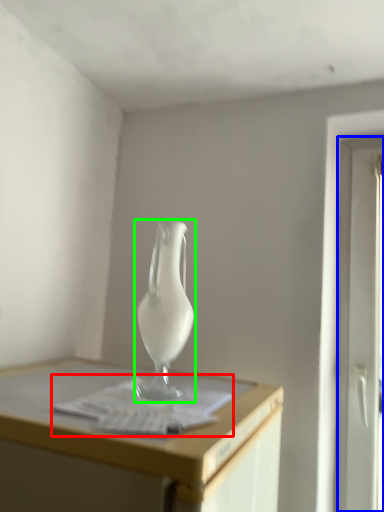
Question: Which object is positioned farthest from paper (highlighted by a red box)? Select from screen door (highlighted by a blue box) and vase (highlighted by a green box).

Choices:
 (A) screen door
 (B) vase

Answer: (A)